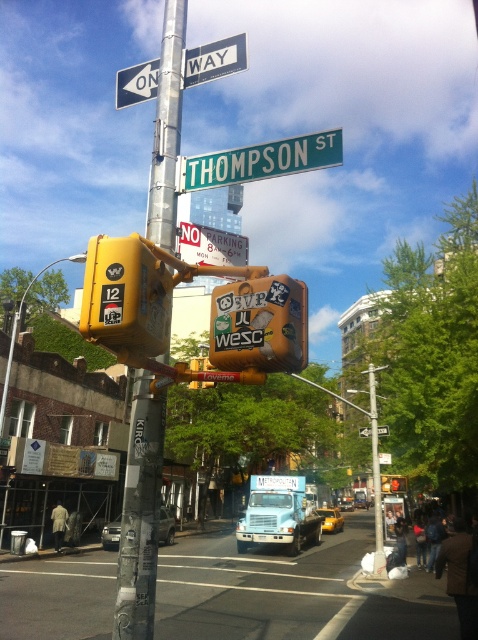
Can you confirm if green metallic street sign at upper center is smaller than metallic pole at center?

Yes.

Measure the distance between green metallic street sign at upper center and metallic pole at center.

green metallic street sign at upper center and metallic pole at center are 10.06 meters apart.

Identify the location of green metallic street sign at upper center. The width and height of the screenshot is (478, 640). (260, 161).

Between point (246, 236) and point (369, 364), which one is positioned behind?

The point (246, 236) is behind.

Locate an element on the screen. This screenshot has height=640, width=478. white paper sign at upper center is located at coordinates (210, 244).

Describe the element at coordinates (210, 244) in the screenshot. I see `white paper sign at upper center` at that location.

What are the coordinates of `white paper sign at upper center` in the screenshot? It's located at (210, 244).

Does point (119, 269) lie behind point (194, 241)?

No, it is in front of (194, 241).

Is yellow matte traffic light at upper left shorter than white paper sign at upper center?

Correct, yellow matte traffic light at upper left is not as tall as white paper sign at upper center.

Where is `yellow matte traffic light at upper left`? The height and width of the screenshot is (640, 478). yellow matte traffic light at upper left is located at coordinates (127, 298).

Where is `yellow matte traffic light at upper left`? The image size is (478, 640). yellow matte traffic light at upper left is located at coordinates (127, 298).